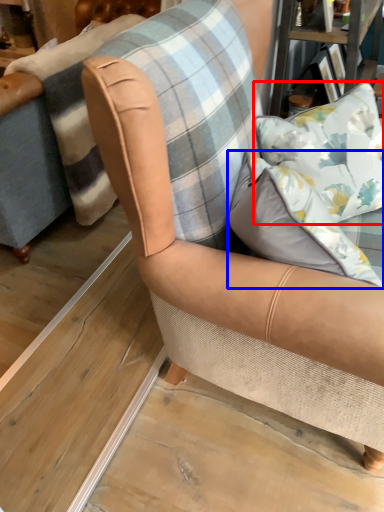
Question: Which of the following is the farthest to the observer, pillow (highlighted by a red box) or pillow (highlighted by a blue box)?

Choices:
 (A) pillow
 (B) pillow

Answer: (A)